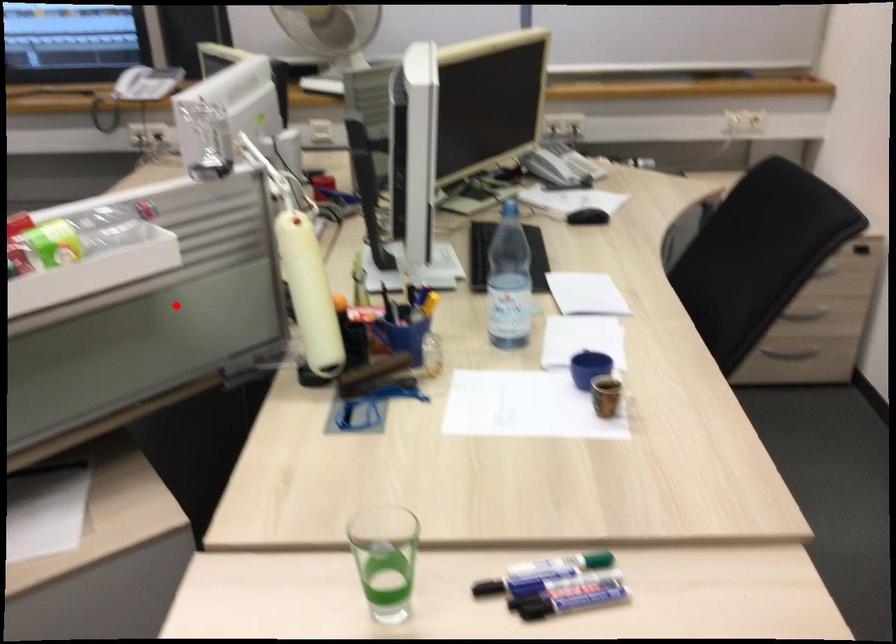
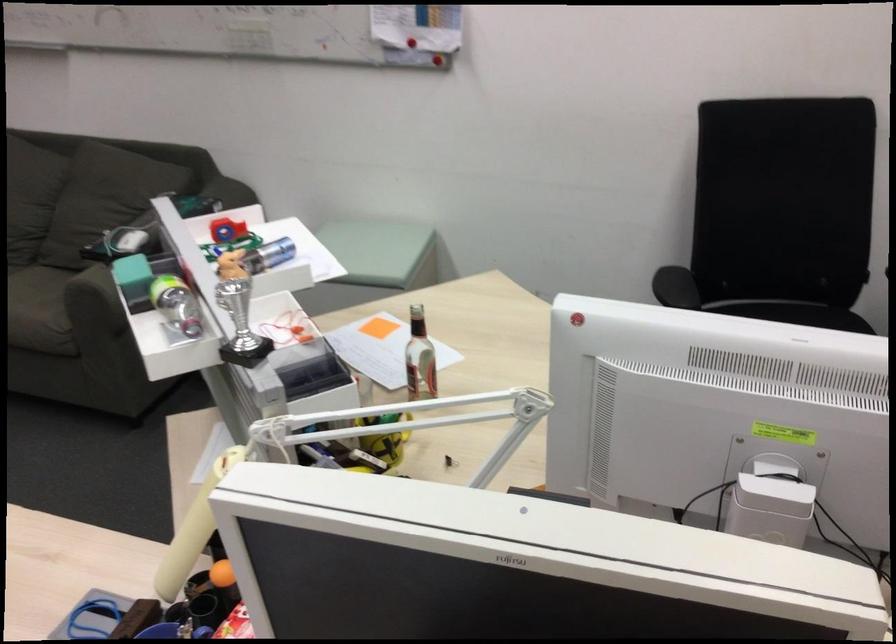
Locate, in the second image, the point that corresponds to the highlighted location in the first image.

(367, 460)